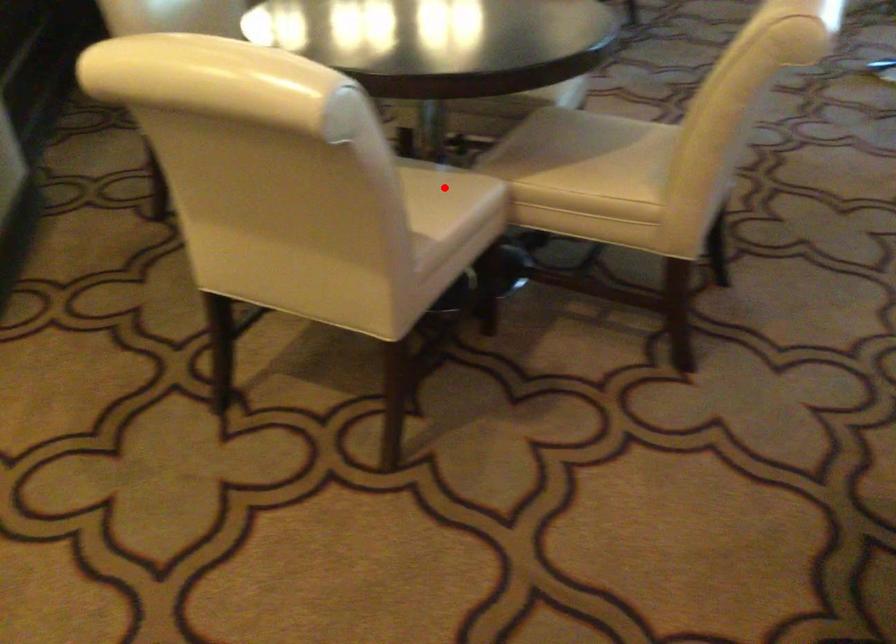
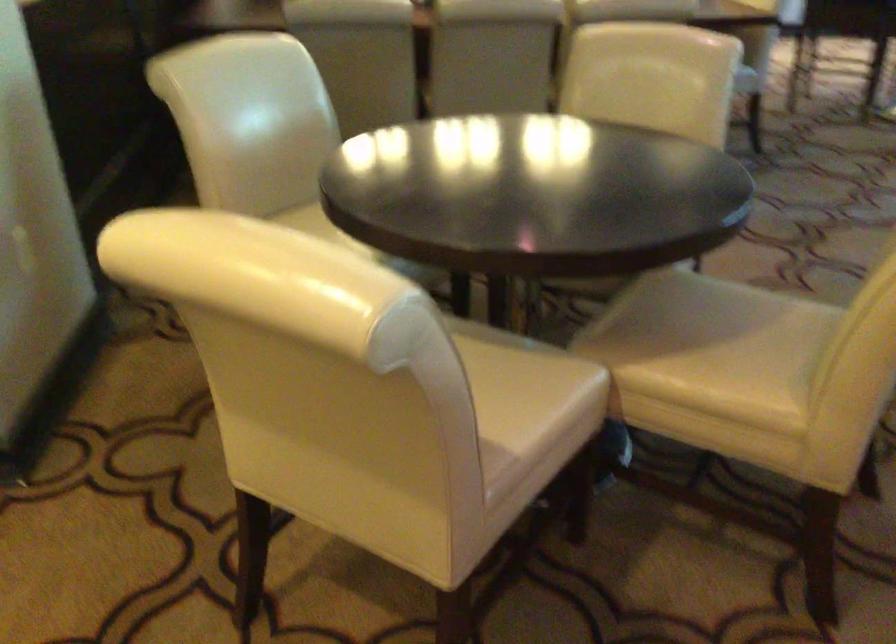
Question: I am providing you with two images of the same scene from different viewpoints. A red point is shown in image1. For the corresponding object point in image2, is it positioned nearer or farther from the camera?

Choices:
 (A) Nearer
 (B) Farther

Answer: (A)